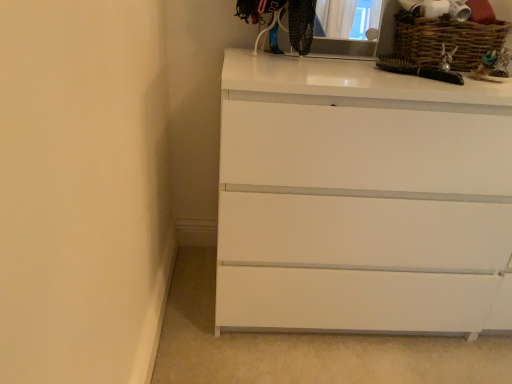
Question: From the image's perspective, is matte black medicine cabinet at upper center on white glossy chest of drawers at center?

Choices:
 (A) yes
 (B) no

Answer: (A)

Question: Can we say matte black medicine cabinet at upper center lies outside white glossy chest of drawers at center?

Choices:
 (A) yes
 (B) no

Answer: (A)

Question: From the image's perspective, does matte black medicine cabinet at upper center appear lower than white glossy chest of drawers at center?

Choices:
 (A) yes
 (B) no

Answer: (B)

Question: Does matte black medicine cabinet at upper center lie in front of white glossy chest of drawers at center?

Choices:
 (A) no
 (B) yes

Answer: (A)

Question: Are matte black medicine cabinet at upper center and white glossy chest of drawers at center beside each other?

Choices:
 (A) no
 (B) yes

Answer: (A)

Question: From their relative heights in the image, would you say woven brown basket at upper right is taller or shorter than matte black medicine cabinet at upper center?

Choices:
 (A) short
 (B) tall

Answer: (A)

Question: Is point (499, 38) closer or farther from the camera than point (364, 51)?

Choices:
 (A) closer
 (B) farther

Answer: (A)

Question: Relative to matte black medicine cabinet at upper center, is woven brown basket at upper right in front or behind?

Choices:
 (A) front
 (B) behind

Answer: (B)

Question: From a real-world perspective, is woven brown basket at upper right physically located above or below matte black medicine cabinet at upper center?

Choices:
 (A) above
 (B) below

Answer: (B)

Question: From the image's perspective, is matte black medicine cabinet at upper center positioned above or below white glossy chest of drawers at center?

Choices:
 (A) below
 (B) above

Answer: (B)

Question: In terms of width, does matte black medicine cabinet at upper center look wider or thinner when compared to white glossy chest of drawers at center?

Choices:
 (A) thin
 (B) wide

Answer: (A)

Question: Considering their positions, is matte black medicine cabinet at upper center located in front of or behind white glossy chest of drawers at center?

Choices:
 (A) front
 (B) behind

Answer: (B)

Question: Do you think matte black medicine cabinet at upper center is within white glossy chest of drawers at center, or outside of it?

Choices:
 (A) inside
 (B) outside

Answer: (B)

Question: Is point (266, 319) positioned closer to the camera than point (347, 49)?

Choices:
 (A) farther
 (B) closer

Answer: (B)

Question: Choose the correct answer: Is white glossy chest of drawers at center inside matte black medicine cabinet at upper center or outside it?

Choices:
 (A) outside
 (B) inside

Answer: (A)